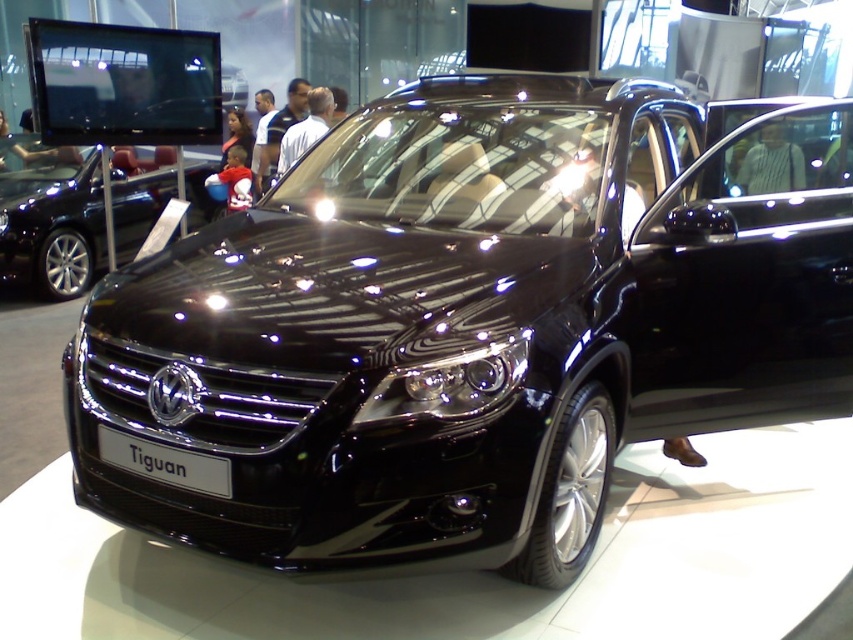
Question: Is glossy black car at center wider than glossy chrome headlight at center?

Choices:
 (A) yes
 (B) no

Answer: (A)

Question: Which point is closer to the camera?

Choices:
 (A) white plastic sign at center
 (B) glossy black car at center

Answer: (A)

Question: Which point is closer to the camera?

Choices:
 (A) glossy chrome headlight at center
 (B) glossy black car at center
 (C) white plastic sign at center

Answer: (A)

Question: Does glossy black car at center come behind glossy chrome headlight at center?

Choices:
 (A) no
 (B) yes

Answer: (B)

Question: Can you confirm if glossy black car at center is positioned below white plastic sign at center?

Choices:
 (A) no
 (B) yes

Answer: (A)

Question: Which point is farther from the camera taking this photo?

Choices:
 (A) (160, 465)
 (B) (78, 288)
 (C) (469, 358)

Answer: (B)